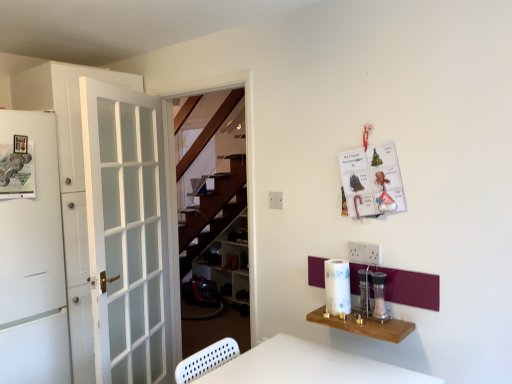
You are a GUI agent. You are given a task and a screenshot of the screen. Output one action in this format:
    pyautogui.click(x=<x>, y=<y>)
    Task: Click on the free space in front of clear glass salt and pepper shakers at right, placed as the 1th appliance when sorted from right to left
    The image size is (512, 384).
    Given the screenshot: What is the action you would take?
    pyautogui.click(x=387, y=329)